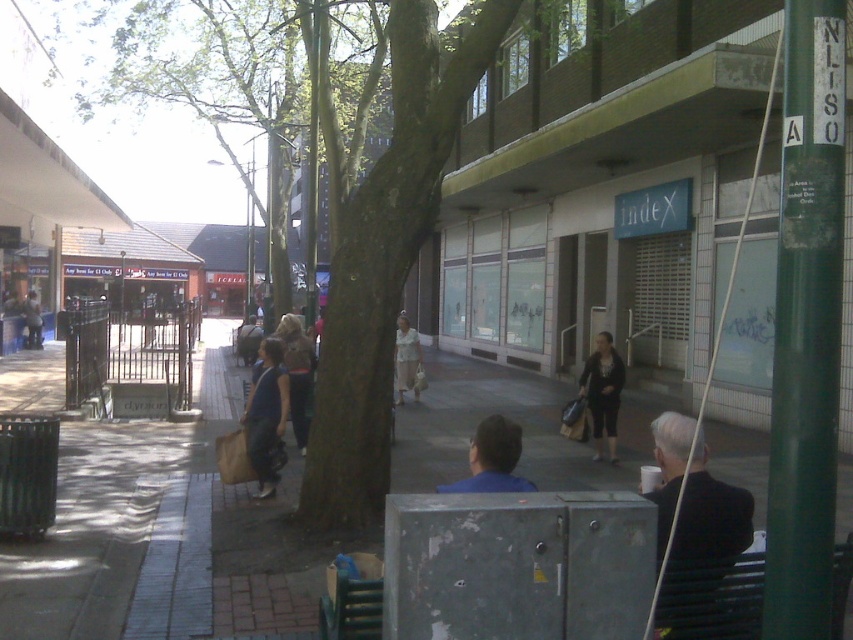
Question: Is matte brown shirt at center smaller than light brown fabric dress at center?

Choices:
 (A) yes
 (B) no

Answer: (B)

Question: Is black fabric jacket at lower right smaller than matte blue shirt at center?

Choices:
 (A) no
 (B) yes

Answer: (B)

Question: Can you confirm if smooth concrete pavement at center is positioned above blue shirt at center?

Choices:
 (A) yes
 (B) no

Answer: (B)

Question: Among these points, which one is farthest from the camera?

Choices:
 (A) (33, 300)
 (B) (610, 420)
 (C) (691, 545)

Answer: (A)

Question: Which object is farther from the camera taking this photo?

Choices:
 (A) light brown fabric dress at center
 (B) metallic dark green bench at lower right
 (C) blue shirt at center
 (D) black fabric jacket at lower right

Answer: (A)

Question: Among these objects, which one is farthest from the camera?

Choices:
 (A) matte brown shirt at center
 (B) black fabric jacket at lower right
 (C) brown leather park bench at center

Answer: (C)